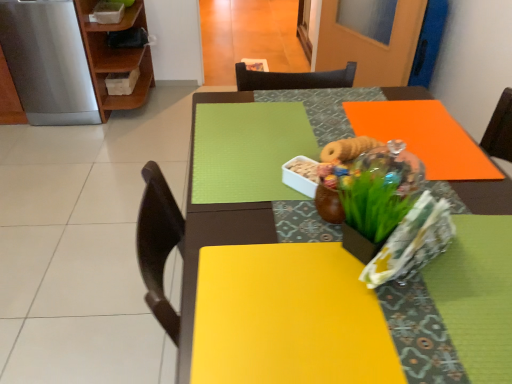
Question: Is green matte floral arrangement at center positioned beyond the bounds of wooden shelf at upper left?

Choices:
 (A) no
 (B) yes

Answer: (B)

Question: From the image's perspective, would you say green matte floral arrangement at center is shown under wooden shelf at upper left?

Choices:
 (A) no
 (B) yes

Answer: (B)

Question: Does green matte floral arrangement at center have a smaller size compared to wooden shelf at upper left?

Choices:
 (A) yes
 (B) no

Answer: (A)

Question: Could you tell me if green matte floral arrangement at center is turned towards wooden shelf at upper left?

Choices:
 (A) no
 (B) yes

Answer: (A)

Question: Is green matte floral arrangement at center further to camera compared to wooden shelf at upper left?

Choices:
 (A) no
 (B) yes

Answer: (A)

Question: Considering the relative sizes of green matte floral arrangement at center and wooden shelf at upper left in the image provided, is green matte floral arrangement at center taller than wooden shelf at upper left?

Choices:
 (A) no
 (B) yes

Answer: (A)

Question: From the image's perspective, would you say orange matte table at upper right is positioned over green matte floral arrangement at center?

Choices:
 (A) yes
 (B) no

Answer: (B)

Question: Considering the relative positions of orange matte table at upper right and green matte floral arrangement at center in the image provided, is orange matte table at upper right in front of green matte floral arrangement at center?

Choices:
 (A) yes
 (B) no

Answer: (A)

Question: Does orange matte table at upper right appear on the right side of green matte floral arrangement at center?

Choices:
 (A) no
 (B) yes

Answer: (B)

Question: Considering the relative sizes of orange matte table at upper right and green matte floral arrangement at center in the image provided, is orange matte table at upper right thinner than green matte floral arrangement at center?

Choices:
 (A) no
 (B) yes

Answer: (A)

Question: Is orange matte table at upper right next to green matte floral arrangement at center and touching it?

Choices:
 (A) yes
 (B) no

Answer: (B)

Question: Is orange matte table at upper right positioned far away from green matte floral arrangement at center?

Choices:
 (A) no
 (B) yes

Answer: (A)

Question: Is green matte floral arrangement at center a part of wooden shelf at upper left?

Choices:
 (A) yes
 (B) no

Answer: (B)